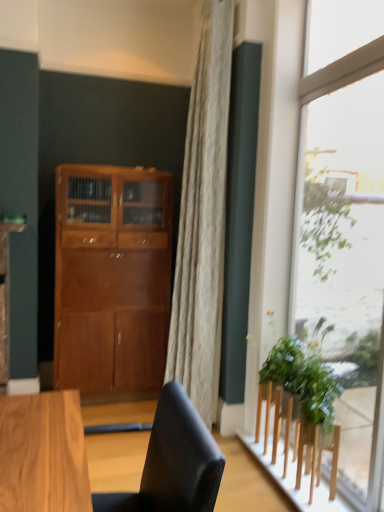
Question: Is matte wood cabinet at center further to camera compared to wooden stool at lower right?

Choices:
 (A) yes
 (B) no

Answer: (A)

Question: From a real-world perspective, does matte wood cabinet at center stand above wooden stool at lower right?

Choices:
 (A) no
 (B) yes

Answer: (B)

Question: Could you tell me if matte wood cabinet at center is facing wooden stool at lower right?

Choices:
 (A) yes
 (B) no

Answer: (B)

Question: Is matte wood cabinet at center at the right side of wooden stool at lower right?

Choices:
 (A) no
 (B) yes

Answer: (A)

Question: Considering the relative sizes of matte wood cabinet at center and wooden stool at lower right in the image provided, is matte wood cabinet at center smaller than wooden stool at lower right?

Choices:
 (A) yes
 (B) no

Answer: (B)

Question: Does point (382, 115) appear closer or farther from the camera than point (183, 442)?

Choices:
 (A) closer
 (B) farther

Answer: (B)

Question: Relative to matte black chair at lower center, is transparent glass window at right in front or behind?

Choices:
 (A) front
 (B) behind

Answer: (B)

Question: Which is correct: transparent glass window at right is inside matte black chair at lower center, or outside of it?

Choices:
 (A) outside
 (B) inside

Answer: (A)

Question: From the image's perspective, relative to matte black chair at lower center, is transparent glass window at right above or below?

Choices:
 (A) below
 (B) above

Answer: (B)

Question: Considering their positions, is matte wood cabinet at center located in front of or behind wooden stool at lower right?

Choices:
 (A) behind
 (B) front

Answer: (A)

Question: Visually, is matte wood cabinet at center positioned to the left or to the right of wooden stool at lower right?

Choices:
 (A) right
 (B) left

Answer: (B)

Question: Considering the positions of matte wood cabinet at center and wooden stool at lower right in the image, is matte wood cabinet at center wider or thinner than wooden stool at lower right?

Choices:
 (A) wide
 (B) thin

Answer: (A)

Question: From a real-world perspective, is matte wood cabinet at center physically located above or below wooden stool at lower right?

Choices:
 (A) above
 (B) below

Answer: (A)

Question: Choose the correct answer: Is green leafy plant at right inside matte black chair at lower center or outside it?

Choices:
 (A) outside
 (B) inside

Answer: (A)

Question: Would you say green leafy plant at right is to the left or to the right of matte black chair at lower center in the picture?

Choices:
 (A) left
 (B) right

Answer: (B)